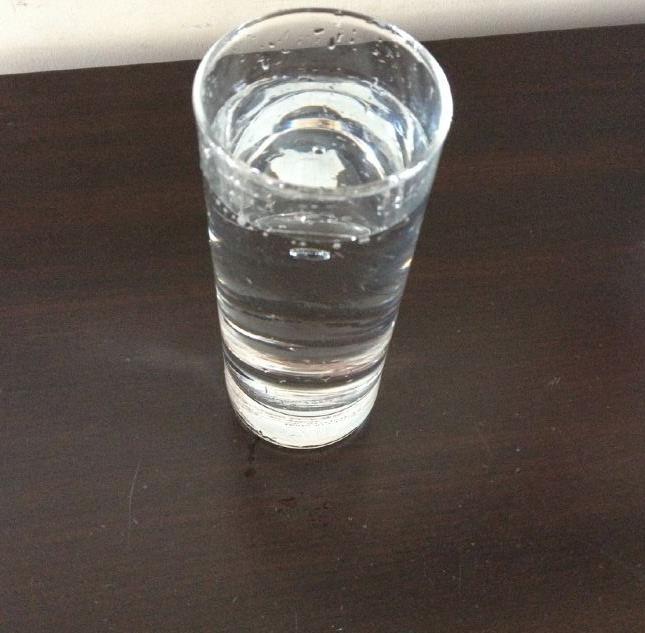
I want to click on glass, so click(330, 285).